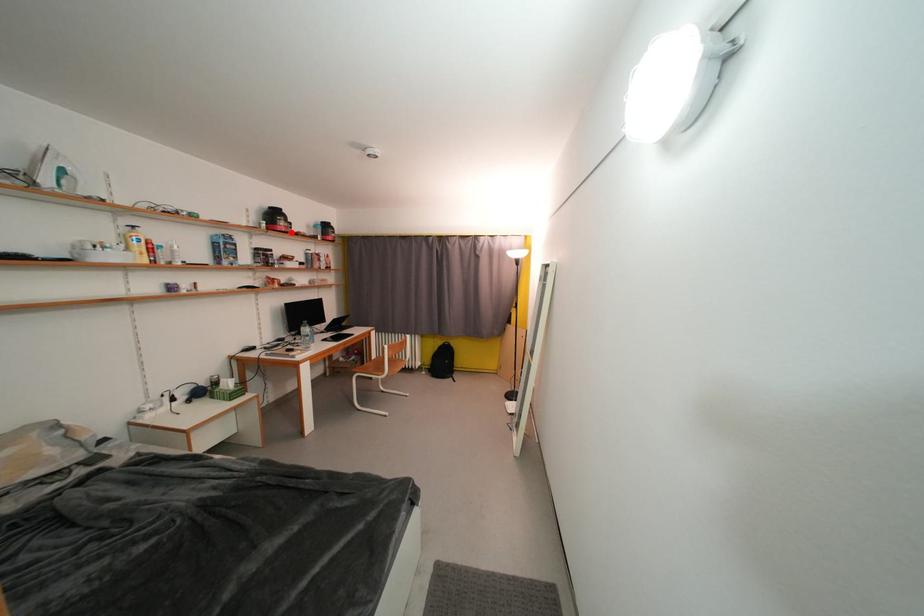
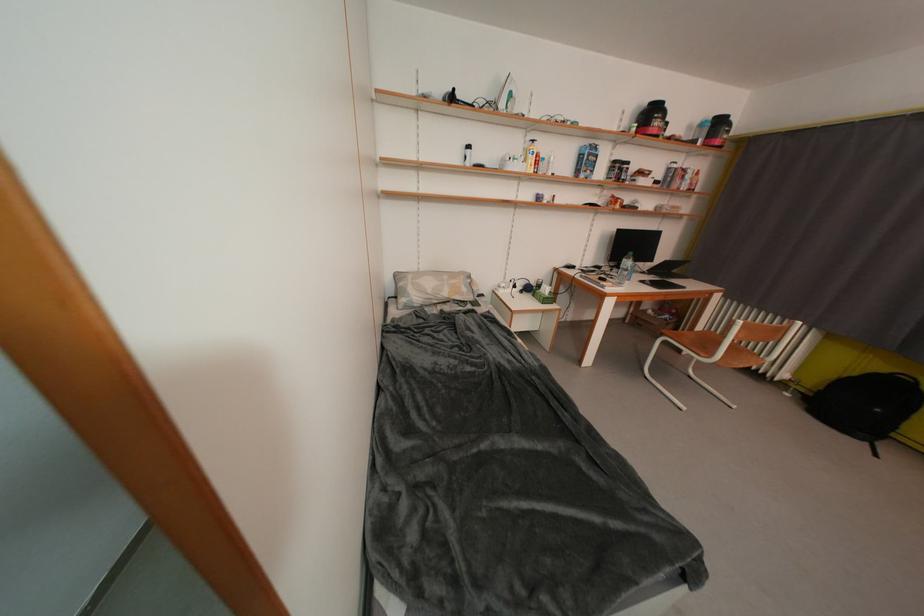
Find the pixel in the second image that matches the highlighted location in the first image.

(663, 136)